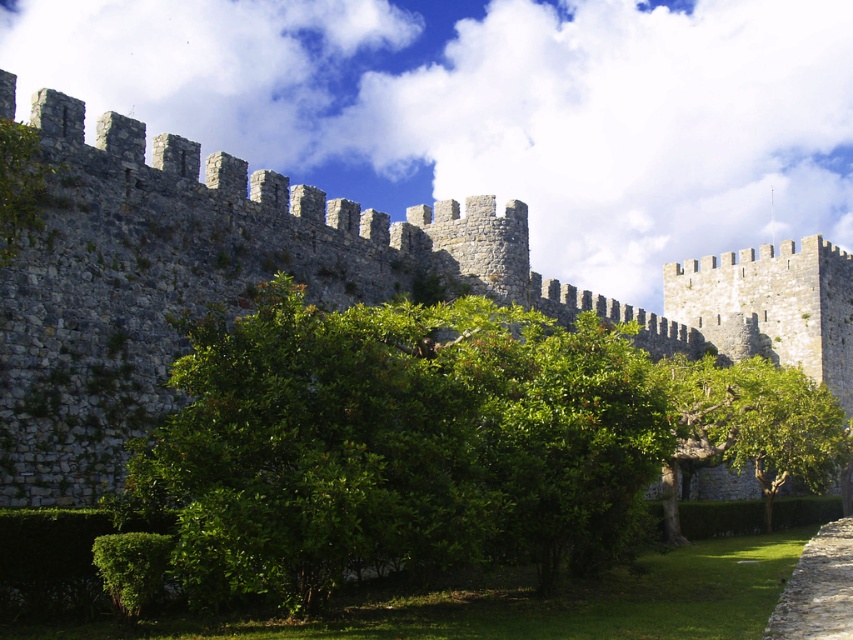
From the picture: Can you confirm if green leafy bush at center is taller than gray stone wall at lower right?

Yes, green leafy bush at center is taller than gray stone wall at lower right.

Does green leafy bush at center have a lesser width compared to gray stone wall at lower right?

In fact, green leafy bush at center might be wider than gray stone wall at lower right.

Locate an element on the screen. The height and width of the screenshot is (640, 853). green leafy bush at center is located at coordinates (393, 444).

Describe the element at coordinates (393, 444) in the screenshot. I see `green leafy bush at center` at that location.

Can you confirm if green leafy bush at center is thinner than gray stone wall at center?

Yes.

What do you see at coordinates (393, 444) in the screenshot?
I see `green leafy bush at center` at bounding box center [393, 444].

Find the location of a particular element. green leafy bush at center is located at coordinates (393, 444).

Can you confirm if gray stone wall at center is positioned above gray stone wall at lower right?

Yes.

Which is behind, point (270, 236) or point (821, 564)?

The point (270, 236) is behind.

Locate an element on the screen. gray stone wall at center is located at coordinates (305, 288).

The width and height of the screenshot is (853, 640). What are the coordinates of `gray stone wall at center` in the screenshot? It's located at (305, 288).